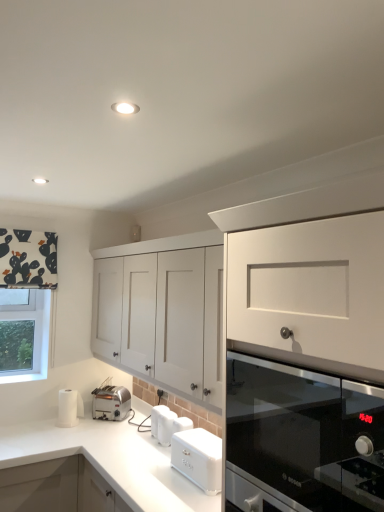
Question: Is silver metallic toaster at lower left, which is counted as the second kitchen appliance, starting from the right, oriented away from clear glass window at left?

Choices:
 (A) yes
 (B) no

Answer: (B)

Question: From the image's perspective, is silver metallic toaster at lower left, arranged as the first kitchen appliance when viewed from the back, located beneath clear glass window at left?

Choices:
 (A) no
 (B) yes

Answer: (B)

Question: Is silver metallic toaster at lower left, which is the first kitchen appliance from left to right, oriented towards clear glass window at left?

Choices:
 (A) no
 (B) yes

Answer: (A)

Question: Is silver metallic toaster at lower left, which is counted as the second kitchen appliance, starting from the right, completely or partially outside of clear glass window at left?

Choices:
 (A) no
 (B) yes

Answer: (B)

Question: Is silver metallic toaster at lower left, arranged as the first kitchen appliance when viewed from the back, wider than clear glass window at left?

Choices:
 (A) no
 (B) yes

Answer: (B)

Question: Is silver metallic toaster at lower left, which is the first kitchen appliance from left to right, surrounding clear glass window at left?

Choices:
 (A) no
 (B) yes

Answer: (A)

Question: Can you confirm if white matte cabinet at center is wider than white matte bread bin at lower center, which is counted as the 1th kitchen appliance, starting from the front?

Choices:
 (A) yes
 (B) no

Answer: (A)

Question: Is white matte cabinet at center next to white matte bread bin at lower center, which is counted as the 1th kitchen appliance, starting from the front, and touching it?

Choices:
 (A) no
 (B) yes

Answer: (A)

Question: Is white matte cabinet at center positioned beyond the bounds of white matte bread bin at lower center, which is counted as the 1th kitchen appliance, starting from the front?

Choices:
 (A) yes
 (B) no

Answer: (A)

Question: From a real-world perspective, is white matte cabinet at center positioned under white matte bread bin at lower center, the second kitchen appliance viewed from the left, based on gravity?

Choices:
 (A) no
 (B) yes

Answer: (A)

Question: From the image's perspective, is white matte cabinet at center located above white matte bread bin at lower center, which is counted as the 1th kitchen appliance, starting from the front?

Choices:
 (A) yes
 (B) no

Answer: (A)

Question: From the image's perspective, would you say white matte cabinet at center is shown under white matte bread bin at lower center, the 2th kitchen appliance positioned from the back?

Choices:
 (A) no
 (B) yes

Answer: (A)

Question: Is white matte bread bin at lower center, the 2th kitchen appliance positioned from the back, facing away from black glass oven at right?

Choices:
 (A) yes
 (B) no

Answer: (B)